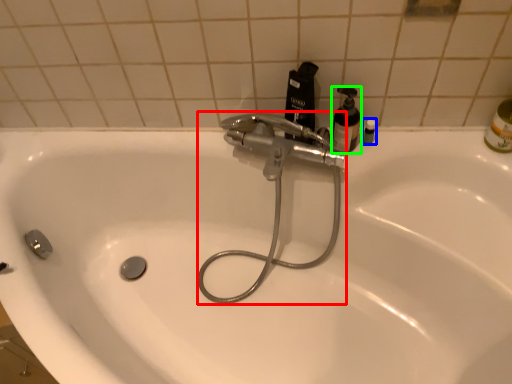
Question: Considering the real-world distances, which object is closest to plumbing fixture (highlighted by a red box)? toiletry (highlighted by a blue box) or mouthwash (highlighted by a green box).

Choices:
 (A) toiletry
 (B) mouthwash

Answer: (B)